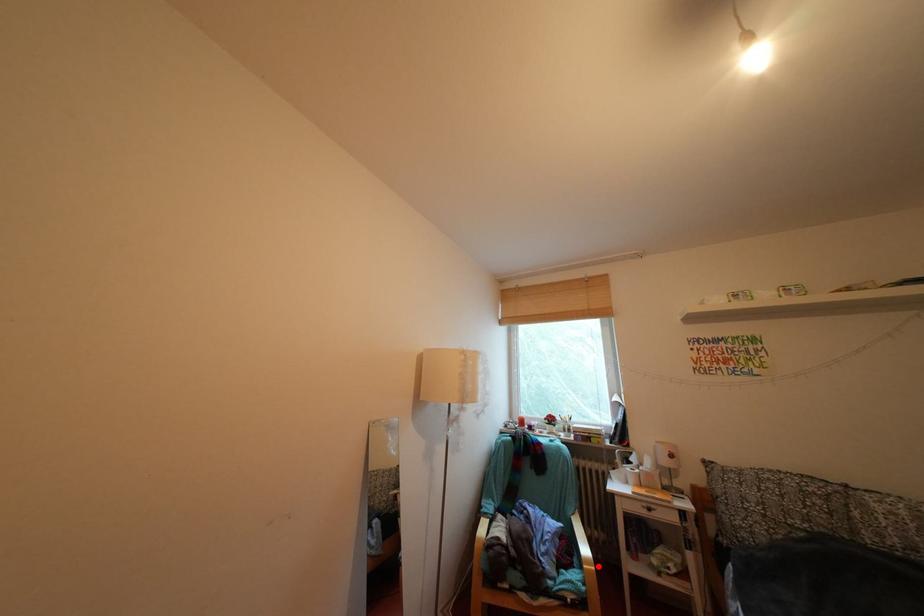
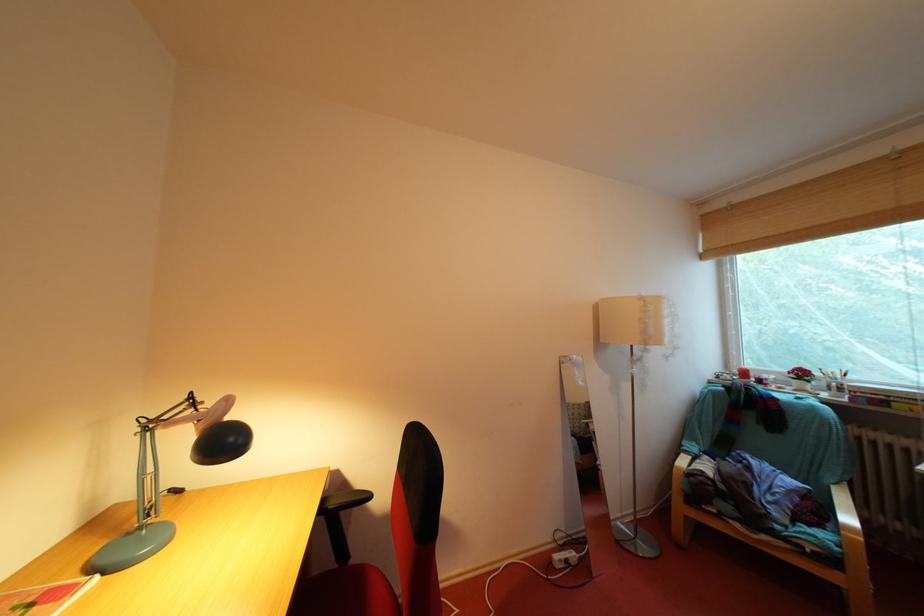
Where in the second image is the point corresponding to the highlighted location from the first image?

(861, 535)